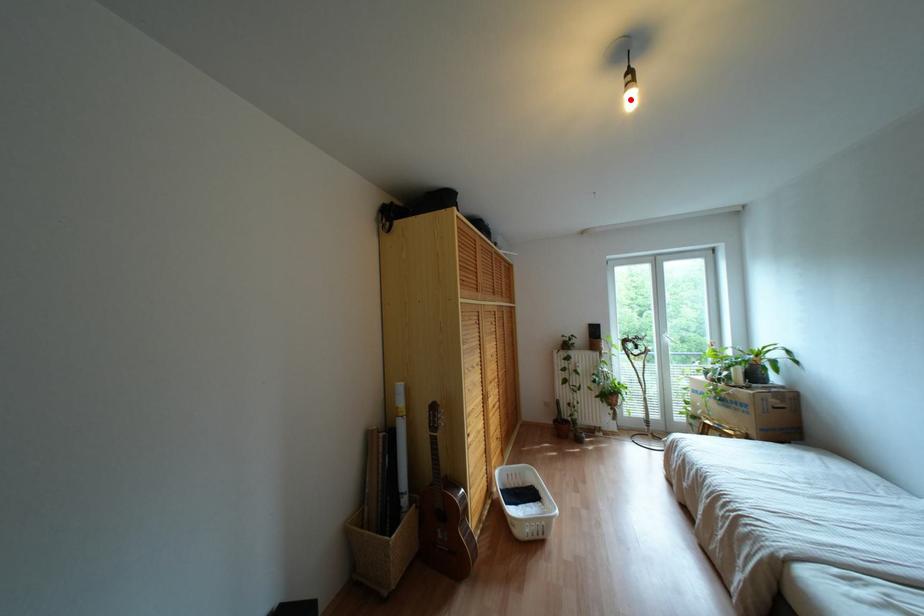
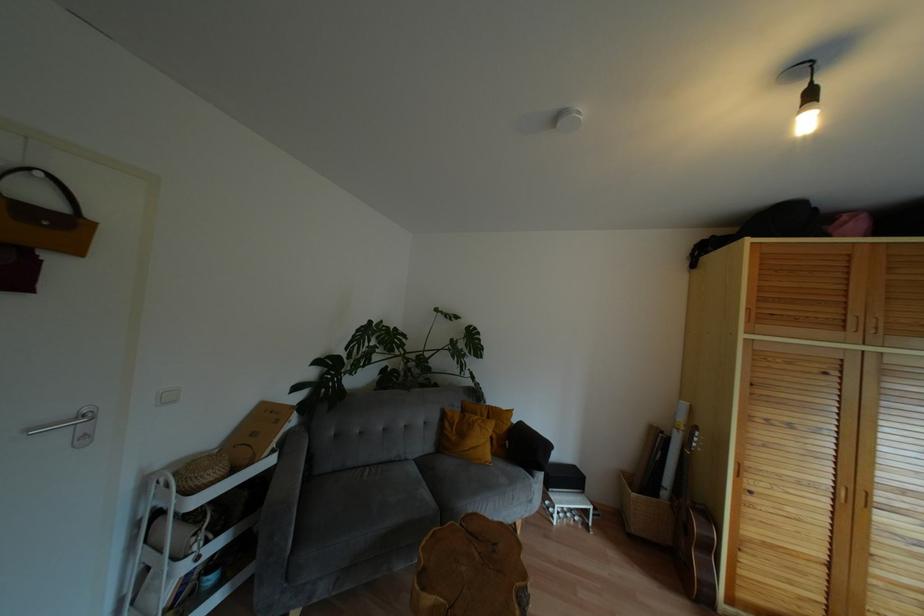
Find the pixel in the second image that matches the highlighted location in the first image.

(806, 123)